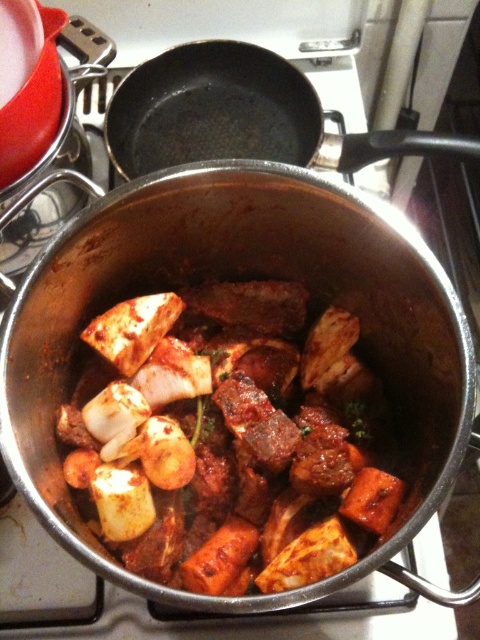
Can you confirm if spicy brown meat and vegetables at center is positioned to the left of black non-stick frying pan at upper center?

Correct, you'll find spicy brown meat and vegetables at center to the left of black non-stick frying pan at upper center.

Can you confirm if spicy brown meat and vegetables at center is bigger than black non-stick frying pan at upper center?

Correct, spicy brown meat and vegetables at center is larger in size than black non-stick frying pan at upper center.

Between point (216, 424) and point (228, 147), which one is positioned behind?

The point (228, 147) is more distant.

Where is `spicy brown meat and vegetables at center`? The image size is (480, 640). spicy brown meat and vegetables at center is located at coordinates (227, 436).